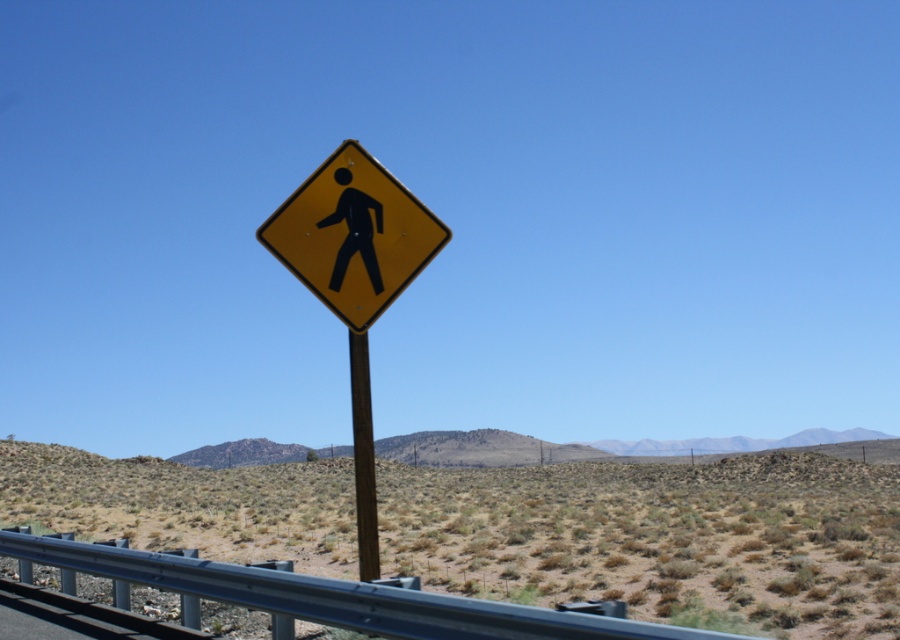
Question: Which is farther from the dried grass at center?

Choices:
 (A) brown wooden pole at center
 (B) yellow plastic pedestrian sign at center
 (C) yellow matte pedestrian sign at center

Answer: (B)

Question: Does dried grass at center appear on the left side of yellow plastic pedestrian sign at center?

Choices:
 (A) no
 (B) yes

Answer: (A)

Question: Which object is farther from the camera taking this photo?

Choices:
 (A) dried grass at center
 (B) brown wooden pole at center
 (C) yellow plastic pedestrian sign at center

Answer: (A)

Question: Can you confirm if dried grass at center is positioned above yellow plastic pedestrian sign at center?

Choices:
 (A) no
 (B) yes

Answer: (A)

Question: Can you confirm if dried grass at center is thinner than brown wooden pole at center?

Choices:
 (A) no
 (B) yes

Answer: (A)

Question: Which point is closer to the camera?

Choices:
 (A) yellow matte pedestrian sign at center
 (B) brown wooden pole at center

Answer: (B)